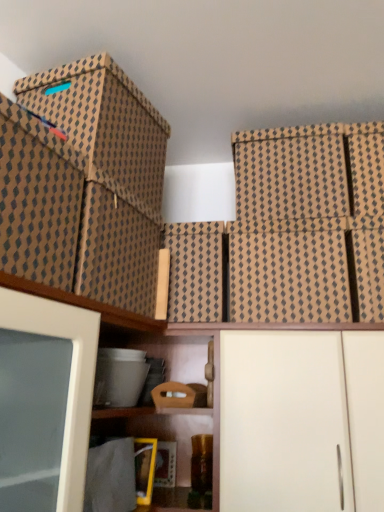
Question: From the image's perspective, relative to brown textured box at center, which ranks as the sixth storage box in left-to-right order, is brown textured box at upper right, placed as the 9th storage box when sorted from left to right, above or below?

Choices:
 (A) below
 (B) above

Answer: (B)

Question: From a real-world perspective, is brown textured box at upper right, placed as the 9th storage box when sorted from left to right, positioned above or below brown textured box at center, positioned as the fourth storage box in right-to-left order?

Choices:
 (A) above
 (B) below

Answer: (A)

Question: Estimate the real-world distances between objects in this image. Which object is farther from the brown cardboard box at center, which is the fifth storage box from right to left?

Choices:
 (A) white matte plastic storage box at lower center, which ranks as the 7th storage box in right-to-left order
 (B) wooden box at center, the sixth storage box positioned from the right
 (C) white matte cabinet at lower center
 (D) brown textured box at center, which ranks as the sixth storage box in left-to-right order
 (E) brown textured box at upper right, placed as the 9th storage box when sorted from left to right

Answer: (E)

Question: Which is nearer to the brown textured box at upper right, acting as the 1th storage box starting from the right?

Choices:
 (A) brown patterned box at upper left, positioned as the 1th storage box in left-to-right order
 (B) brown cardboard box at upper right, which ranks as the 8th storage box in left-to-right order
 (C) wooden box at center, the sixth storage box positioned from the right
 (D) brown textured box at upper right, the seventh storage box viewed from the left
 (E) brown cardboard box at center, which is the fifth storage box from right to left

Answer: (D)